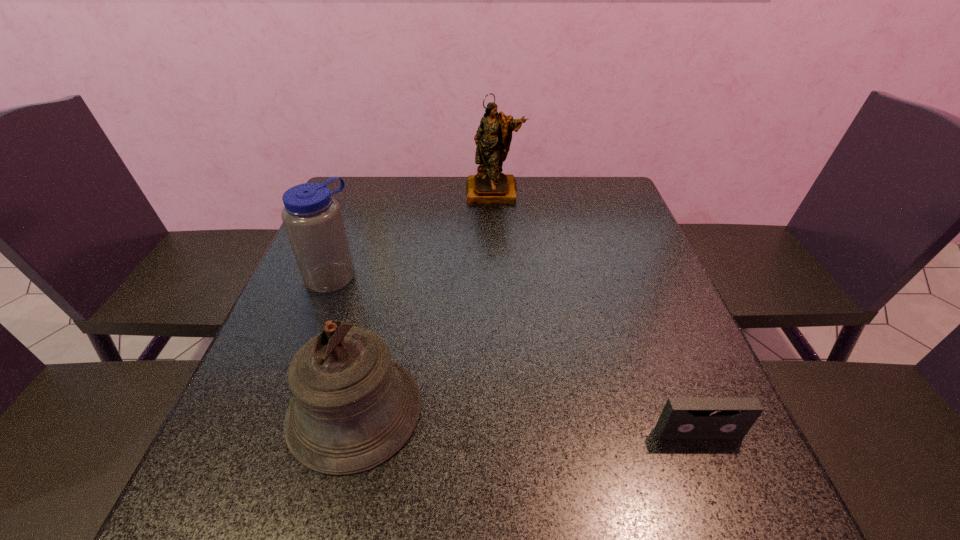
Find the location of a particular element. This screenshot has width=960, height=540. vacant space on the desktop that is between the bell and the videotape and is positioned on the front-facing side of the figurine is located at coordinates (498, 420).

Where is `free spot on the desktop that is between the bell and the shortest object and is positioned with a carrying loop on the side of the second farthest object`? The image size is (960, 540). free spot on the desktop that is between the bell and the shortest object and is positioned with a carrying loop on the side of the second farthest object is located at coordinates (499, 420).